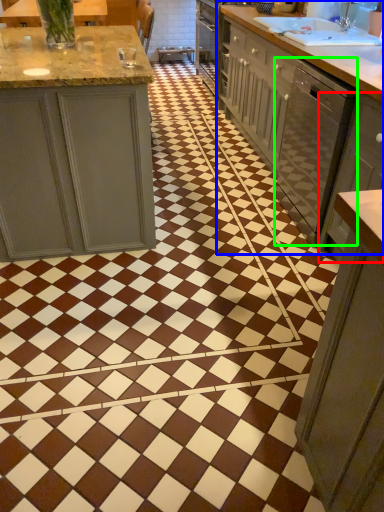
Question: Based on their relative distances, which object is farther from cabinetry (highlighted by a red box)? Choose from countertop (highlighted by a blue box) and dish washer (highlighted by a green box).

Choices:
 (A) countertop
 (B) dish washer

Answer: (A)